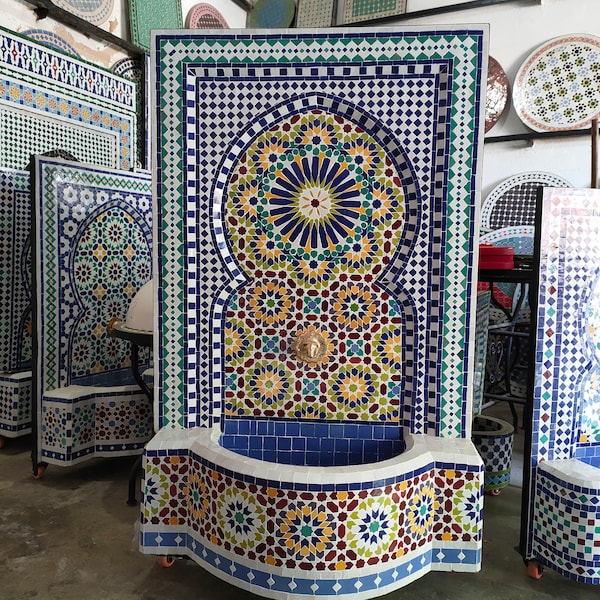
Locate an element on the screen. white walls is located at coordinates (502, 27), (236, 18).